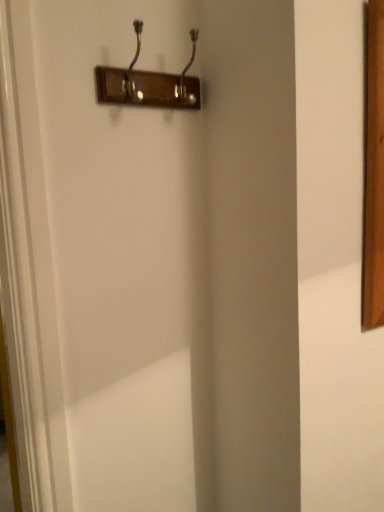
Where is `brown wooden coat rack at upper center`? brown wooden coat rack at upper center is located at coordinates (149, 83).

What do you see at coordinates (149, 83) in the screenshot? The width and height of the screenshot is (384, 512). I see `brown wooden coat rack at upper center` at bounding box center [149, 83].

Where is `brown wooden coat rack at upper center`? The width and height of the screenshot is (384, 512). brown wooden coat rack at upper center is located at coordinates (149, 83).